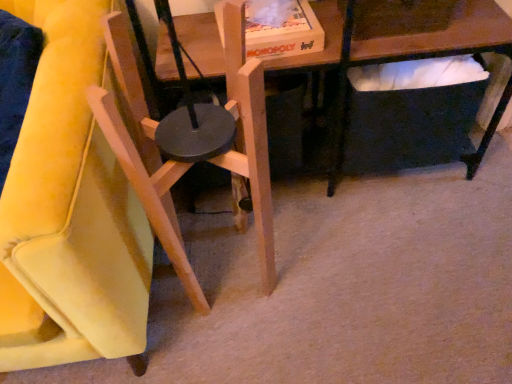
You are a GUI agent. You are given a task and a screenshot of the screen. Output one action in this format:
    pyautogui.click(x=<x>, y=<y>)
    Task: Click on the vacant location below natural wood chair at center, which is the second chair from left to right (from a real-world perspective)
    The height and width of the screenshot is (384, 512).
    Given the screenshot: What is the action you would take?
    pyautogui.click(x=222, y=258)